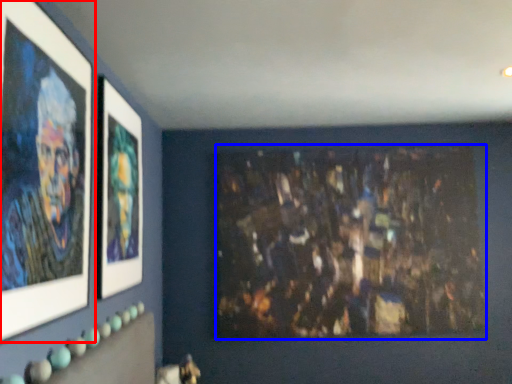
Question: Which of the following is the farthest to the observer, picture frame (highlighted by a red box) or art (highlighted by a blue box)?

Choices:
 (A) picture frame
 (B) art

Answer: (B)